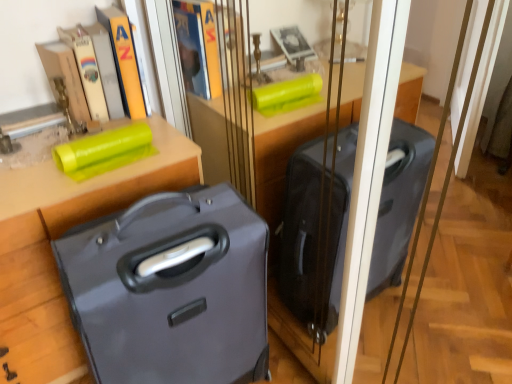
Image resolution: width=512 pixels, height=384 pixels. In order to click on blank space situated above matte black suitcase at left (from a real-world perspective) in this screenshot , I will do `click(51, 142)`.